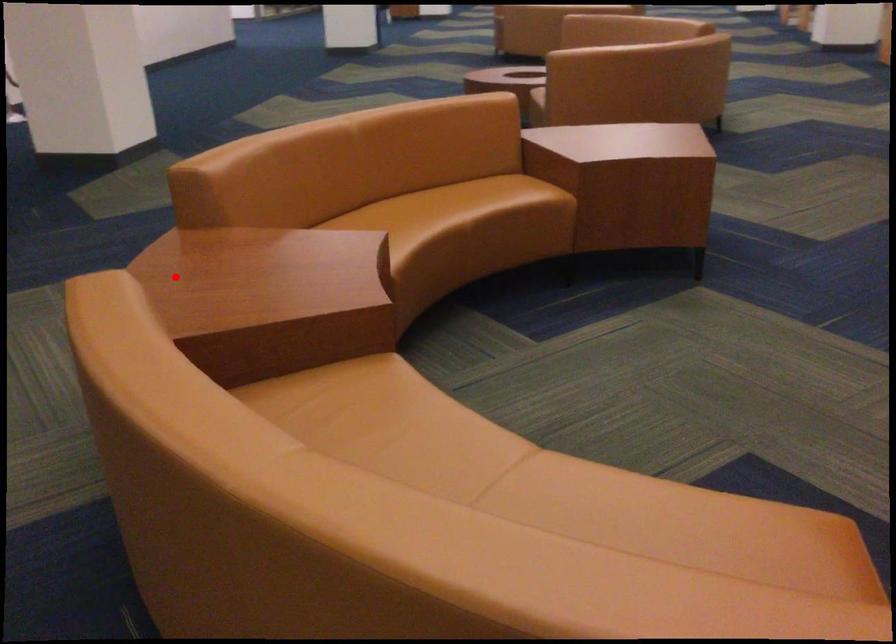
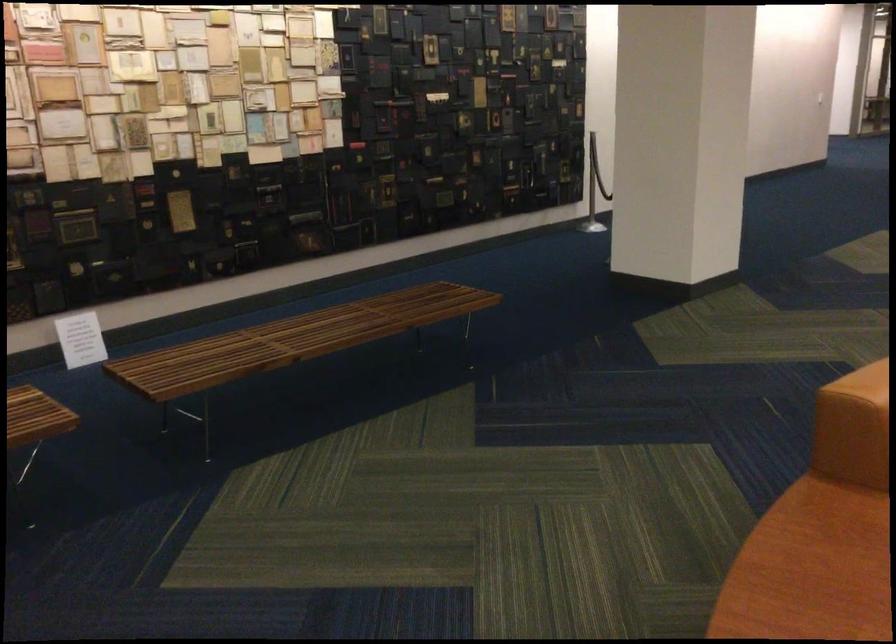
The point at the highlighted location is marked in the first image. Where is the corresponding point in the second image?

(808, 570)